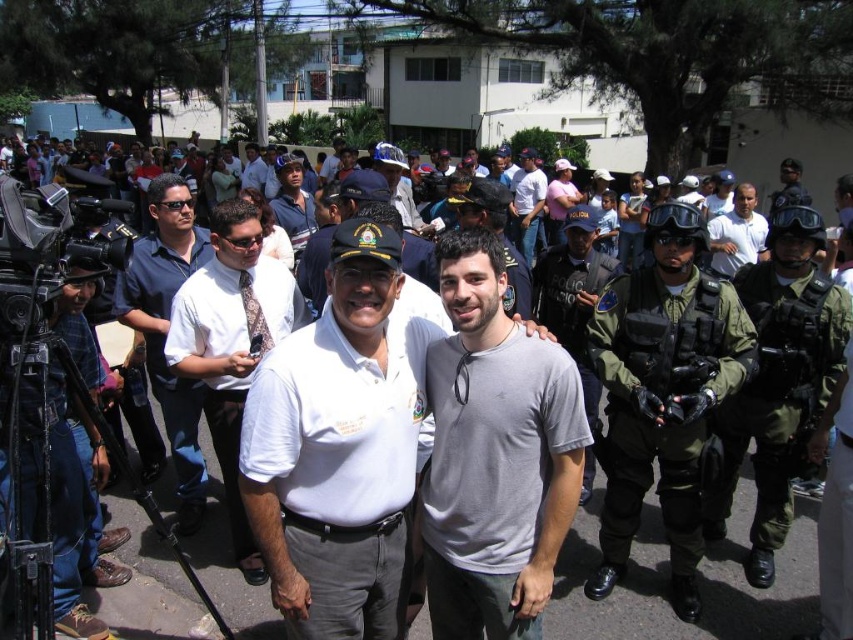
Question: Is white shirt at center positioned behind gray t-shirt at center?

Choices:
 (A) yes
 (B) no

Answer: (B)

Question: Does green tactical gear at right appear on the right side of white matte shirt at upper center?

Choices:
 (A) no
 (B) yes

Answer: (A)

Question: Which of the following is the farthest from the observer?

Choices:
 (A) green uniformed officer at center
 (B) gray matte t-shirt at center

Answer: (A)

Question: Which object is farther from the camera taking this photo?

Choices:
 (A) gray matte t-shirt at center
 (B) white shirt at center
 (C) green tactical vest at center

Answer: (B)

Question: Is green uniformed officer at center closer to camera compared to gray t-shirt at center?

Choices:
 (A) no
 (B) yes

Answer: (B)

Question: Which is nearer to the green uniformed officer at center?

Choices:
 (A) gray t-shirt at center
 (B) white uniform at center
 (C) gray matte t-shirt at center
 (D) white shirt at center

Answer: (C)